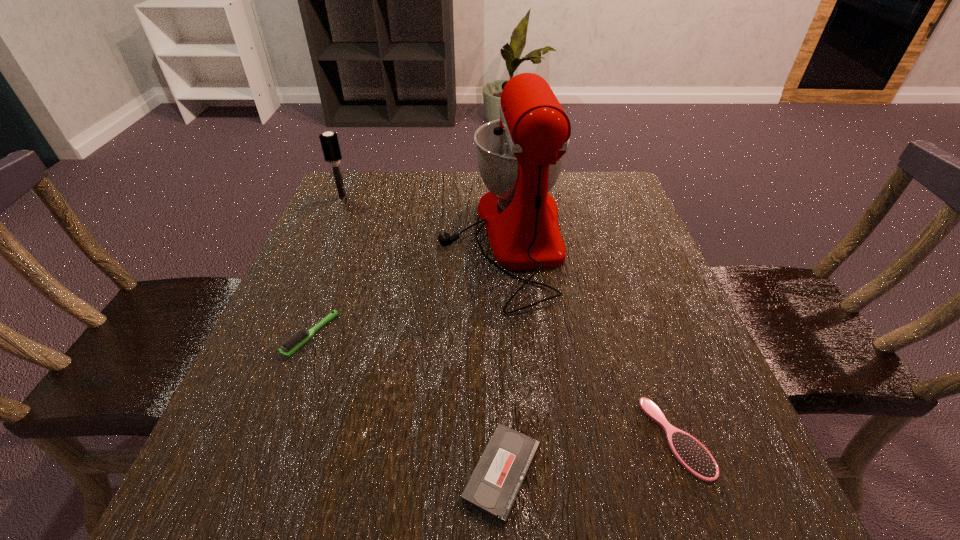
Find the location of a particular element. This screenshot has width=960, height=540. vacant space located on the bowl side of the mixer is located at coordinates (336, 238).

Identify the location of free space located on the right of the fourth shortest object. The image size is (960, 540). (408, 197).

Find the location of `free space located 0.120m on the front of the second farthest hairbrush`. free space located 0.120m on the front of the second farthest hairbrush is located at coordinates (278, 422).

What are the coordinates of `vacant space located 0.130m on the back of the nearest hairbrush` in the screenshot? It's located at (641, 337).

Identify the location of free space located on the back of the shortest object. The width and height of the screenshot is (960, 540). (498, 374).

This screenshot has height=540, width=960. I want to click on mixer that is at the far edge, so click(x=520, y=156).

The height and width of the screenshot is (540, 960). What are the coordinates of `hairbrush situated at the far edge` in the screenshot? It's located at (329, 141).

Find the location of a particular element. This screenshot has height=540, width=960. hairbrush that is at the near edge is located at coordinates (693, 456).

You are a GUI agent. You are given a task and a screenshot of the screen. Output one action in this format:
    pyautogui.click(x=<x>, y=<y>)
    Task: Click on the videotape that is positioned at the near edge
    
    Given the screenshot: What is the action you would take?
    pyautogui.click(x=494, y=485)

This screenshot has height=540, width=960. I want to click on object situated at the right edge, so click(x=693, y=456).